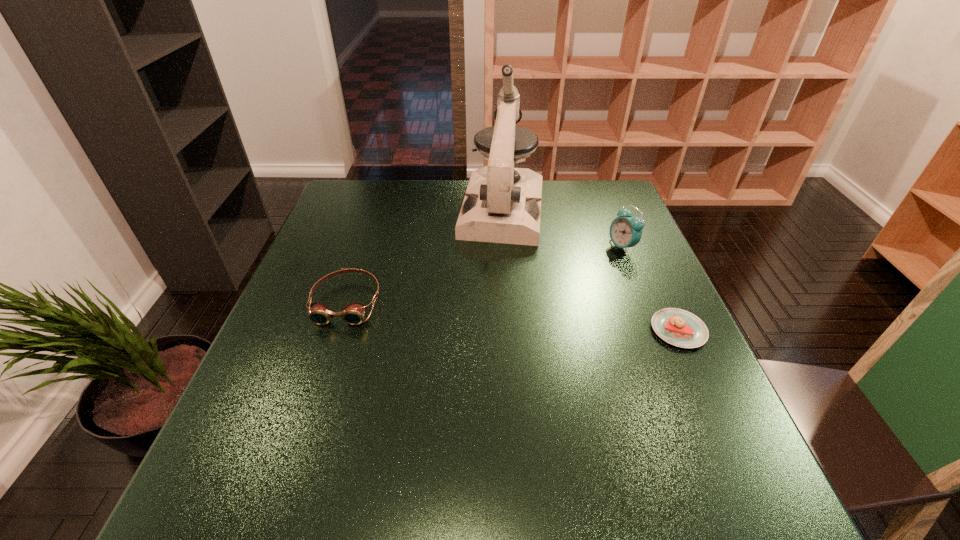
I want to click on vacant area that lies between the goggles and the microscope, so click(x=424, y=256).

Where is `free spot between the pastry and the goggles`? free spot between the pastry and the goggles is located at coordinates (513, 316).

Where is `free spot between the shortest object and the goggles`? This screenshot has height=540, width=960. free spot between the shortest object and the goggles is located at coordinates (513, 316).

This screenshot has height=540, width=960. Identify the location of free point between the second shortest object and the third object from right to left. (424, 256).

At what (x,y) coordinates should I click in order to perform the action: click on object that can be found as the closest to the third tallest object. Please return your answer as a coordinate pair (x, y). This screenshot has height=540, width=960. Looking at the image, I should click on (502, 204).

I want to click on object that stands as the second closest to the goggles, so click(x=625, y=231).

Find the location of `free space in the image that satisfies the following two spatial constraints: 1. on the front side of the pastry; 2. on the left side of the third shortest object`. free space in the image that satisfies the following two spatial constraints: 1. on the front side of the pastry; 2. on the left side of the third shortest object is located at coordinates (656, 330).